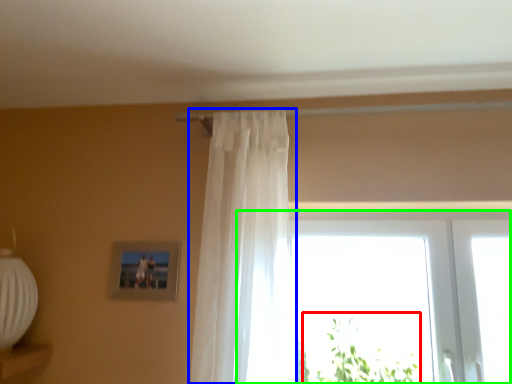
Question: Which object is positioned farthest from plant (highlighted by a red box)? Select from curtain (highlighted by a blue box) and window (highlighted by a green box).

Choices:
 (A) curtain
 (B) window

Answer: (A)